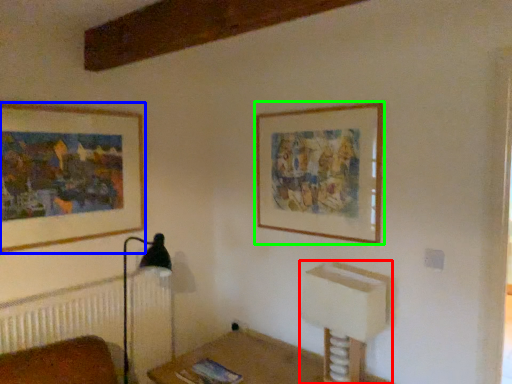
Question: Considering the real-world distances, which object is farthest from vanity (highlighted by a red box)? picture frame (highlighted by a blue box) or picture frame (highlighted by a green box)?

Choices:
 (A) picture frame
 (B) picture frame

Answer: (A)